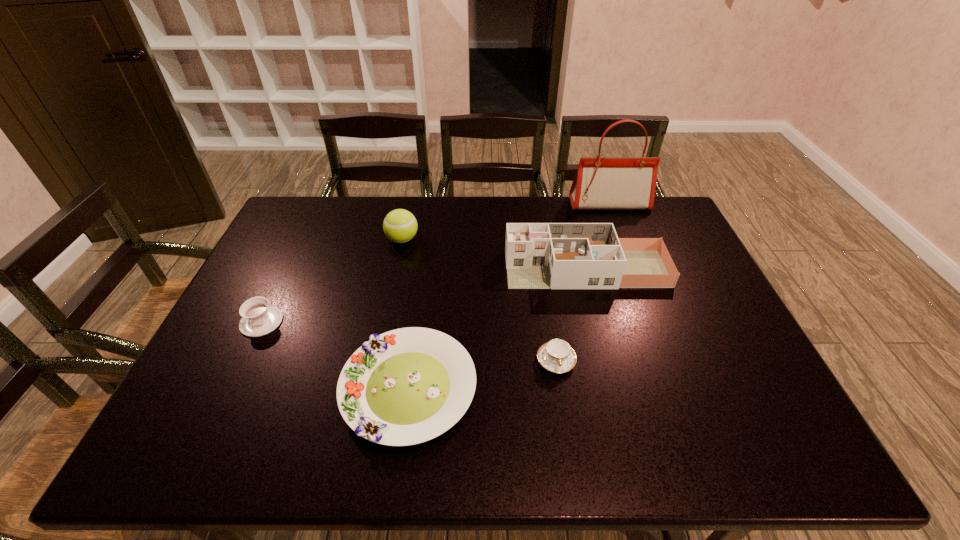
Find the location of a particular element. free space located 0.090m at the entrance of the third farthest object is located at coordinates (477, 269).

This screenshot has width=960, height=540. I want to click on vacant space located 0.100m at the entrance of the third farthest object, so click(474, 269).

You are a GUI agent. You are given a task and a screenshot of the screen. Output one action in this format:
    pyautogui.click(x=<x>, y=<y>)
    Task: Click on the vacant space located 0.190m at the entrance of the third farthest object
    
    Given the screenshot: What is the action you would take?
    pyautogui.click(x=445, y=269)

Where is `vacant region located on the handle side of the leftmost object`? vacant region located on the handle side of the leftmost object is located at coordinates (204, 441).

In order to click on vacant region located 0.130m on the side with the handle of the right teacup in this screenshot , I will do `click(566, 426)`.

The width and height of the screenshot is (960, 540). I want to click on vacant space positioned on the right of the salad plate, so click(x=626, y=388).

Where is `handbag situated at the far edge`? The height and width of the screenshot is (540, 960). handbag situated at the far edge is located at coordinates (617, 183).

Image resolution: width=960 pixels, height=540 pixels. I want to click on tennis ball that is at the far edge, so click(400, 226).

Where is `object located at the near edge`? The image size is (960, 540). object located at the near edge is located at coordinates (406, 386).

I want to click on object located at the left edge, so click(258, 318).